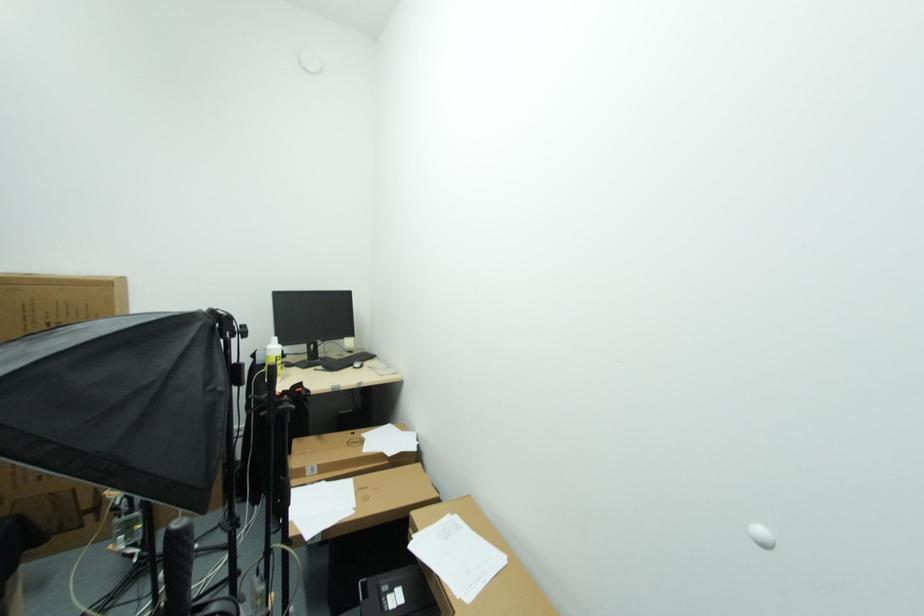
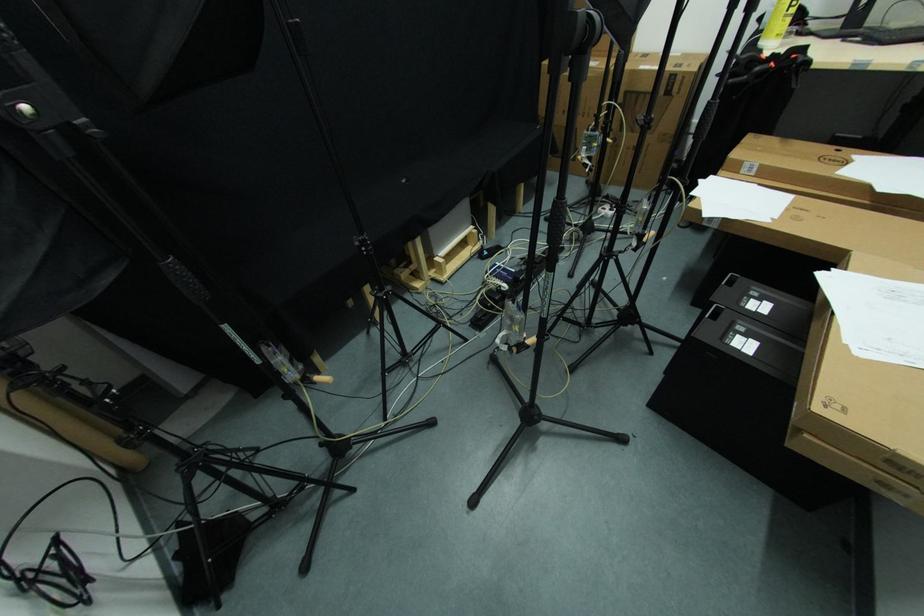
How did the camera likely rotate?

The camera's rotation is toward left-down.